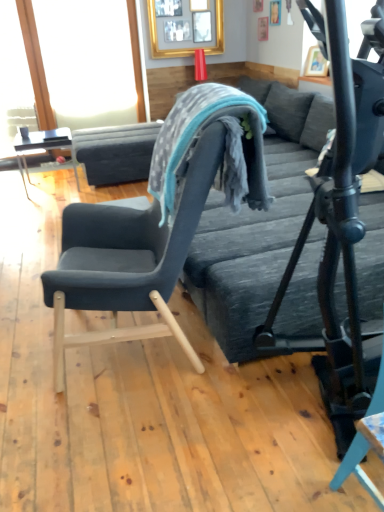
Question: In the image, is matte black table at left on the left side or the right side of textured gray bean bag chair at center?

Choices:
 (A) left
 (B) right

Answer: (A)

Question: Considering the positions of matte black table at left and textured gray bean bag chair at center in the image, is matte black table at left bigger or smaller than textured gray bean bag chair at center?

Choices:
 (A) big
 (B) small

Answer: (A)

Question: Estimate the real-world distances between objects in this image. Which object is farther from the matte black table at left?

Choices:
 (A) textured gray bean bag chair at center
 (B) transparent glass window screen at upper left
 (C) textured gray bed frame at center
 (D) velvet dark blue chair at left
 (E) gold-framed picture at upper center

Answer: (A)

Question: Estimate the real-world distances between objects in this image. Which object is farther from the transparent glass window screen at upper left?

Choices:
 (A) textured gray bed frame at center
 (B) gold-framed picture at upper center
 (C) velvet dark blue chair at left
 (D) matte black table at left
 (E) textured gray bean bag chair at center

Answer: (C)